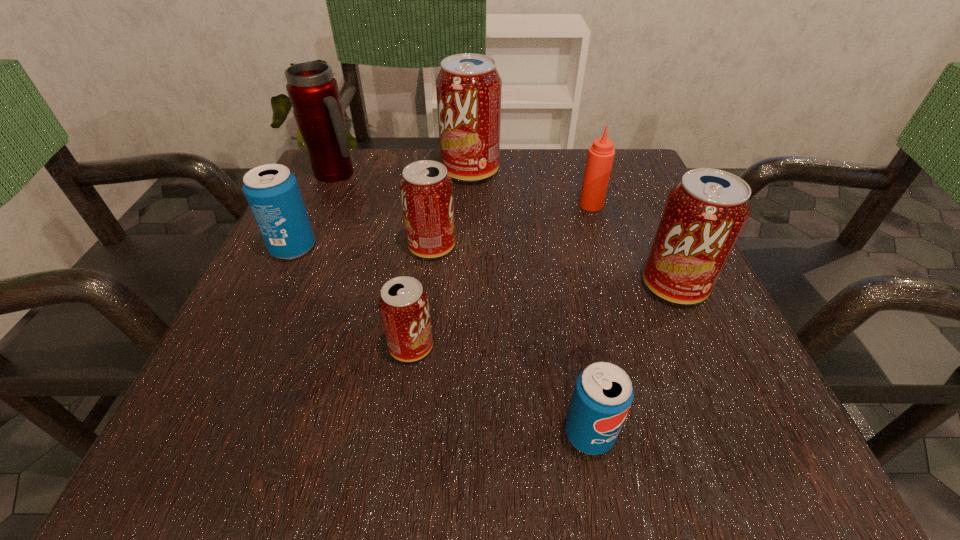
Locate an element on the screen. The width and height of the screenshot is (960, 540). free space between the tallest soda can and the second object from right to left is located at coordinates (531, 188).

I want to click on free area in between the nearest object and the third nearest soda can, so click(632, 360).

Image resolution: width=960 pixels, height=540 pixels. In order to click on free point between the right blue soda can and the farthest red soda can in this screenshot , I will do `click(530, 302)`.

At what (x,y) coordinates should I click in order to perform the action: click on free area in between the seventh farthest object and the farther blue soda can. Please return your answer as a coordinate pair (x, y). Looking at the image, I should click on coord(352,297).

Locate an element on the screen. free space between the left blue soda can and the second smallest red soda can is located at coordinates (363, 247).

The width and height of the screenshot is (960, 540). Identify the location of vacant region between the second nearest soda can and the seventh object from left to right. (501, 275).

Locate an element on the screen. This screenshot has width=960, height=540. object that is the second closest to the thermos bottle is located at coordinates [468, 87].

Where is `object identified as the fourth closest to the second smallest red soda can`? This screenshot has height=540, width=960. object identified as the fourth closest to the second smallest red soda can is located at coordinates (313, 92).

Where is `soda can identified as the fourth closest to the red thermos bottle`? This screenshot has height=540, width=960. soda can identified as the fourth closest to the red thermos bottle is located at coordinates (403, 303).

At what (x,y) coordinates should I click in order to perform the action: click on soda can that stands as the closest to the farther blue soda can. Please return your answer as a coordinate pair (x, y). This screenshot has width=960, height=540. Looking at the image, I should click on (426, 190).